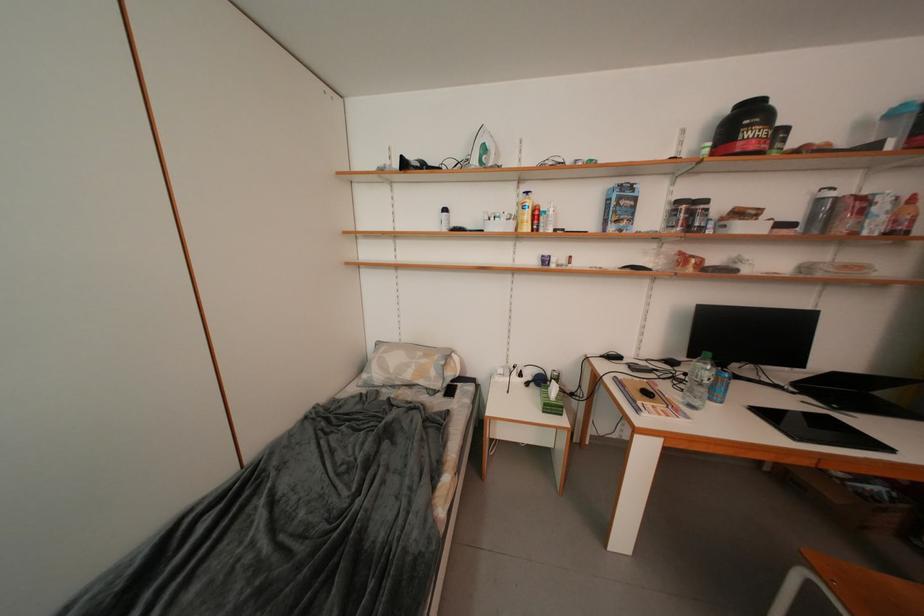
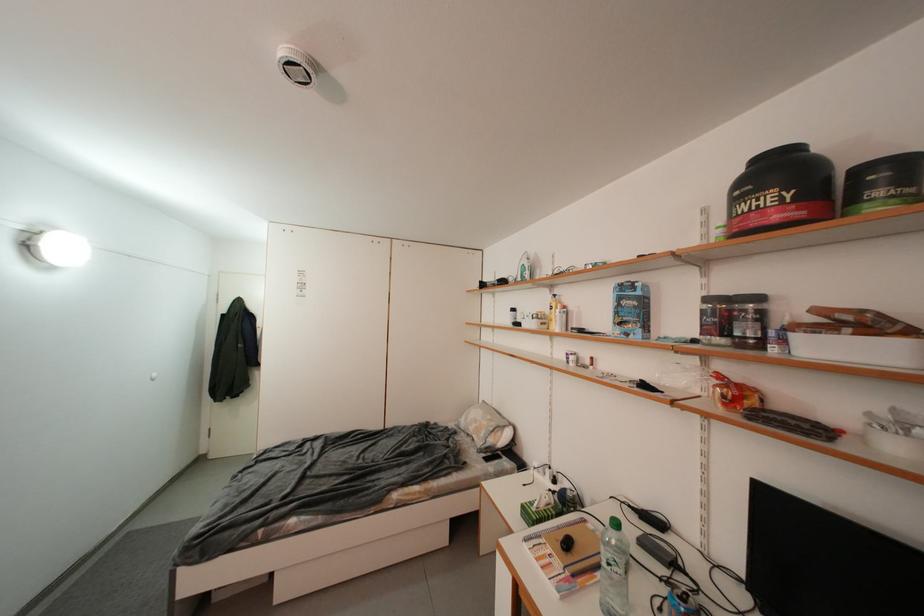
Where in the second image is the point corresponding to (701,270) from the first image?

(733, 408)